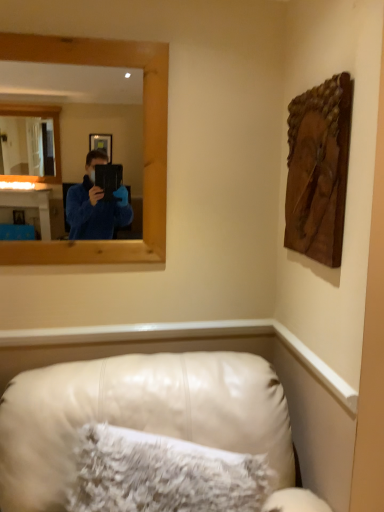
Question: Should I look upward or downward to see leather couch at lower center?

Choices:
 (A) up
 (B) down

Answer: (B)

Question: Are wooden carving at upper right and leather couch at lower center beside each other?

Choices:
 (A) no
 (B) yes

Answer: (A)

Question: Does wooden carving at upper right have a lesser height compared to leather couch at lower center?

Choices:
 (A) yes
 (B) no

Answer: (A)

Question: Are wooden carving at upper right and leather couch at lower center located far from each other?

Choices:
 (A) no
 (B) yes

Answer: (A)

Question: Is wooden carving at upper right taller than leather couch at lower center?

Choices:
 (A) yes
 (B) no

Answer: (B)

Question: From the image's perspective, does wooden carving at upper right appear higher than leather couch at lower center?

Choices:
 (A) no
 (B) yes

Answer: (B)

Question: From a real-world perspective, is wooden carving at upper right beneath leather couch at lower center?

Choices:
 (A) yes
 (B) no

Answer: (B)

Question: Does wooden carving at upper right have a lesser height compared to wooden frame at upper left?

Choices:
 (A) yes
 (B) no

Answer: (A)

Question: Is wooden frame at upper left inside wooden carving at upper right?

Choices:
 (A) yes
 (B) no

Answer: (B)

Question: Is wooden carving at upper right to the right of wooden frame at upper left from the viewer's perspective?

Choices:
 (A) yes
 (B) no

Answer: (A)

Question: Considering the relative sizes of wooden carving at upper right and wooden frame at upper left in the image provided, is wooden carving at upper right wider than wooden frame at upper left?

Choices:
 (A) yes
 (B) no

Answer: (B)

Question: From a real-world perspective, is wooden carving at upper right on top of wooden frame at upper left?

Choices:
 (A) no
 (B) yes

Answer: (A)

Question: Is wooden carving at upper right with wooden frame at upper left?

Choices:
 (A) yes
 (B) no

Answer: (B)

Question: From the image's perspective, does wooden frame at upper left appear lower than wooden carving at upper right?

Choices:
 (A) yes
 (B) no

Answer: (B)